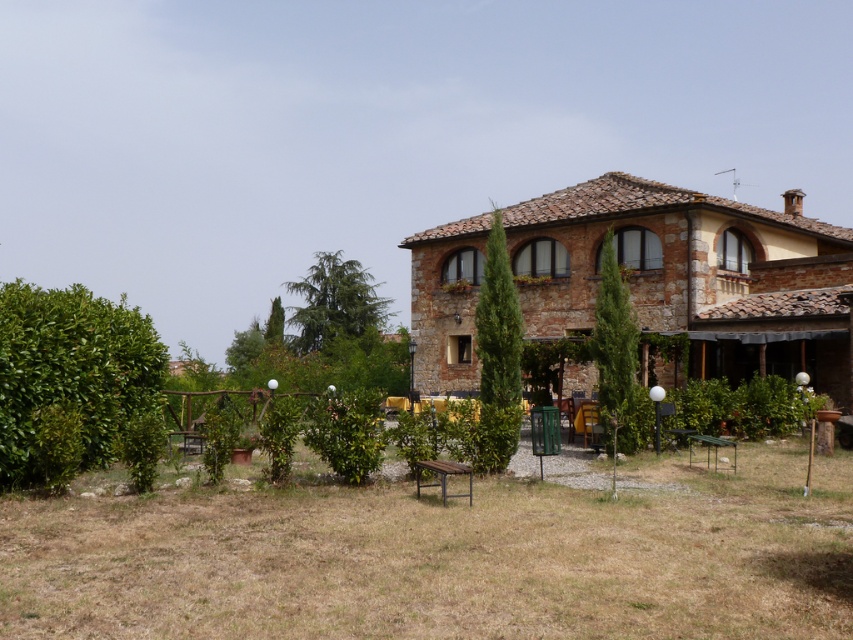
Measure the distance between brown wooden bench at center and camera.

brown wooden bench at center is 21.52 feet away from camera.

Is brown wooden bench at center taller than rustic stone villa at center?

No.

Locate an element on the screen. brown wooden bench at center is located at coordinates (447, 556).